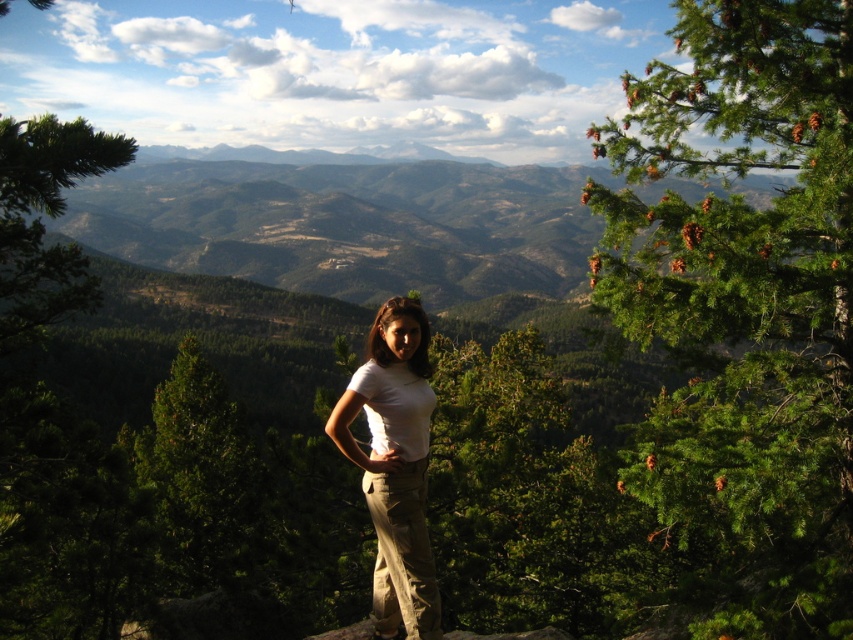
Is green needle-like pine at upper right thinner than white cotton shirt at center?

No, green needle-like pine at upper right is not thinner than white cotton shirt at center.

Who is shorter, green needle-like pine at upper right or white cotton shirt at center?

With less height is white cotton shirt at center.

Is point (701, 40) positioned after point (416, 358)?

Yes, point (701, 40) is farther from viewer.

Identify the location of green needle-like pine at upper right. (744, 305).